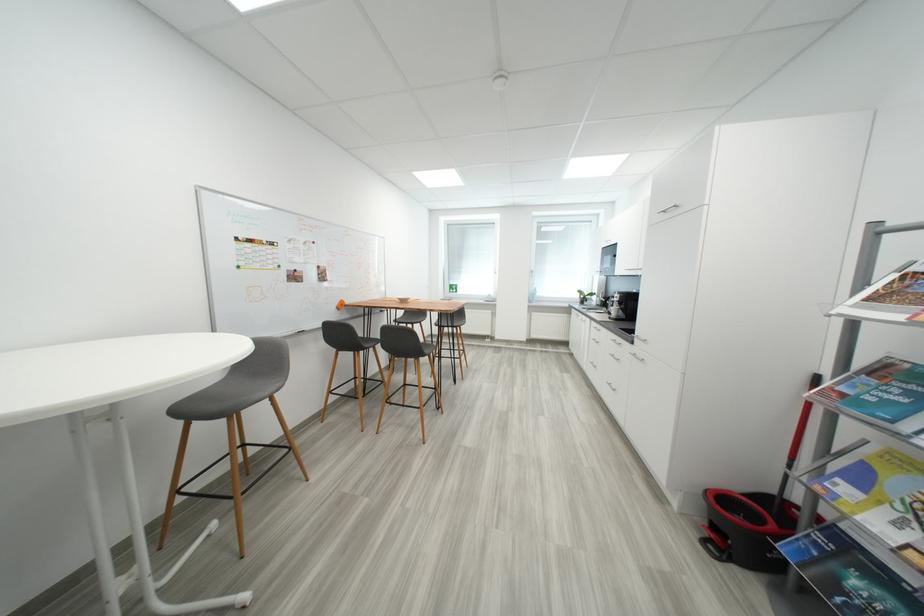
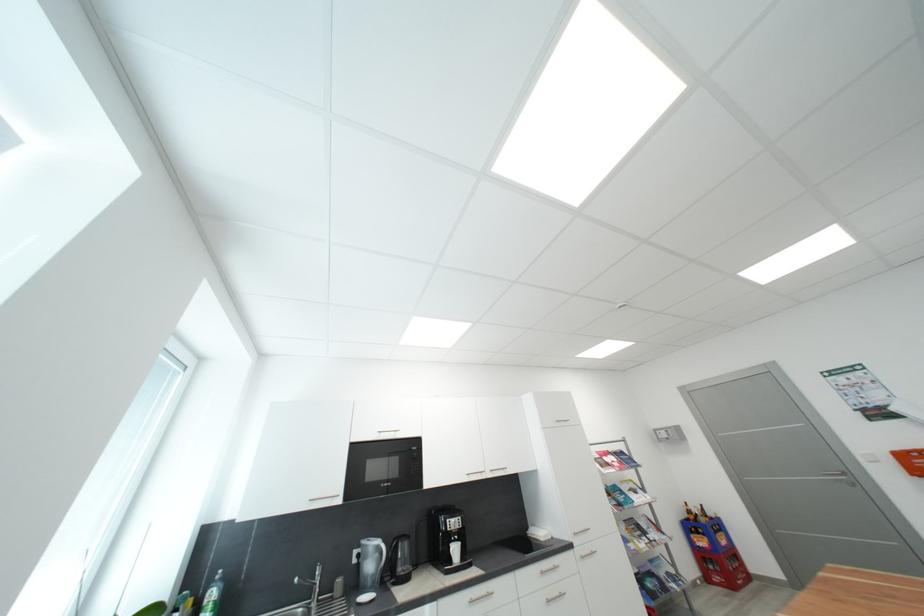
The point at (621, 312) is marked in the first image. Where is the corresponding point in the second image?

(463, 552)